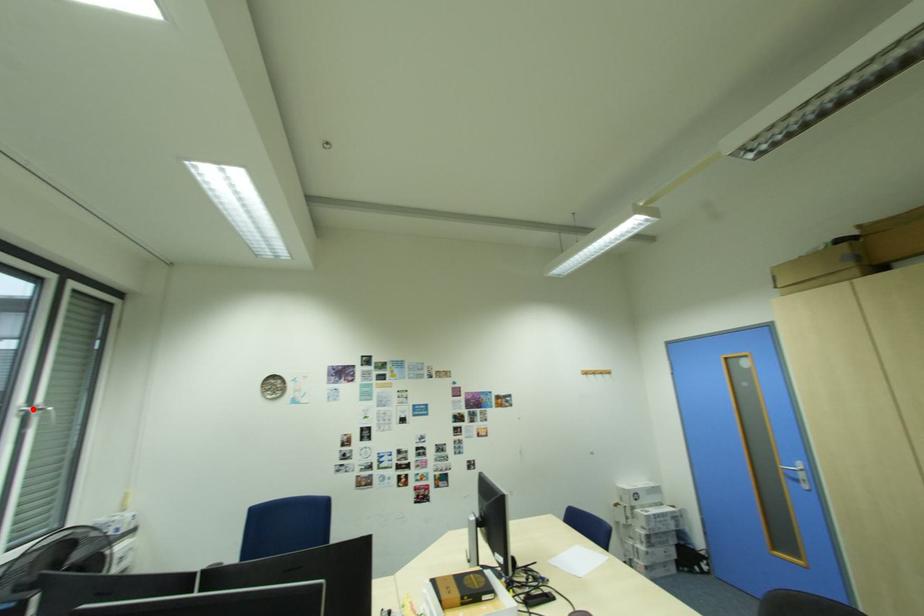
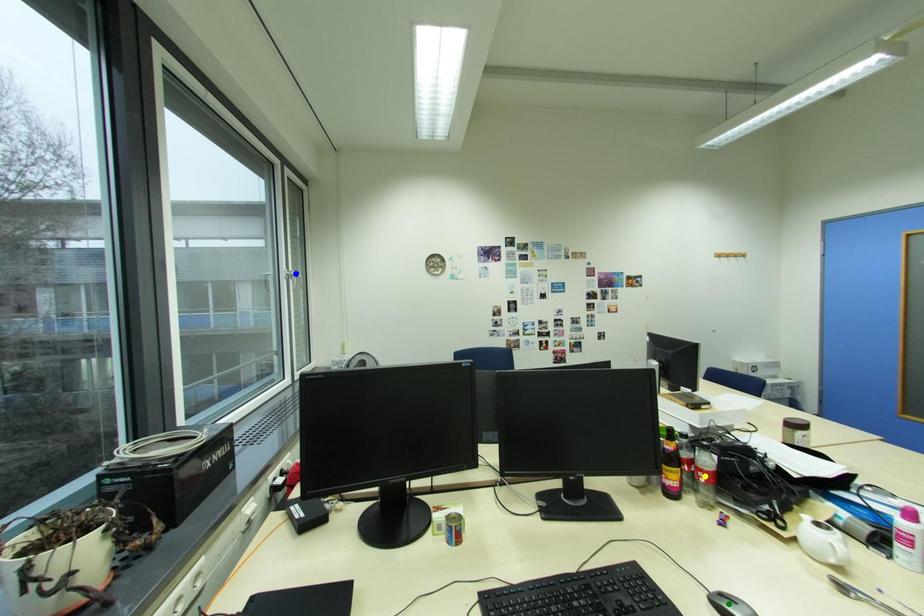
Question: I am providing you with two images of the same scene from different viewpoints. A red point is marked on the first image. You are given multiple points on the second image. Which mark in image 2 goes with the point in image 1?

Choices:
 (A) green point
 (B) yellow point
 (C) blue point

Answer: (C)